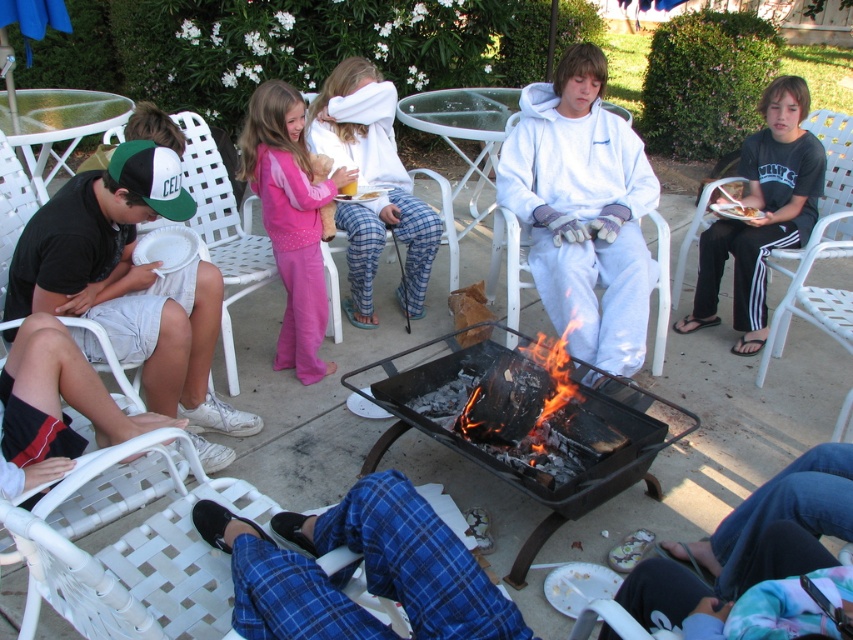
Is the position of charcoal black grill at center less distant than that of charcoal fire at center?

That is True.

Does point (546, 504) lie in front of point (488, 442)?

Yes, it is.

Locate an element on the screen. This screenshot has width=853, height=640. charcoal black grill at center is located at coordinates (529, 433).

Which is in front, point (527, 436) or point (260, 84)?

Point (527, 436) is in front.

Measure the distance between point (498, 451) and camera.

They are 8.07 feet apart.

The height and width of the screenshot is (640, 853). What are the coordinates of `charcoal black grill at center` in the screenshot? It's located at (529, 433).

Does black cotton shorts at left have a larger size compared to charcoal fire at center?

Correct, black cotton shorts at left is larger in size than charcoal fire at center.

Does black cotton shorts at left have a lesser width compared to charcoal fire at center?

No.

Image resolution: width=853 pixels, height=640 pixels. I want to click on black cotton shorts at left, so click(x=129, y=280).